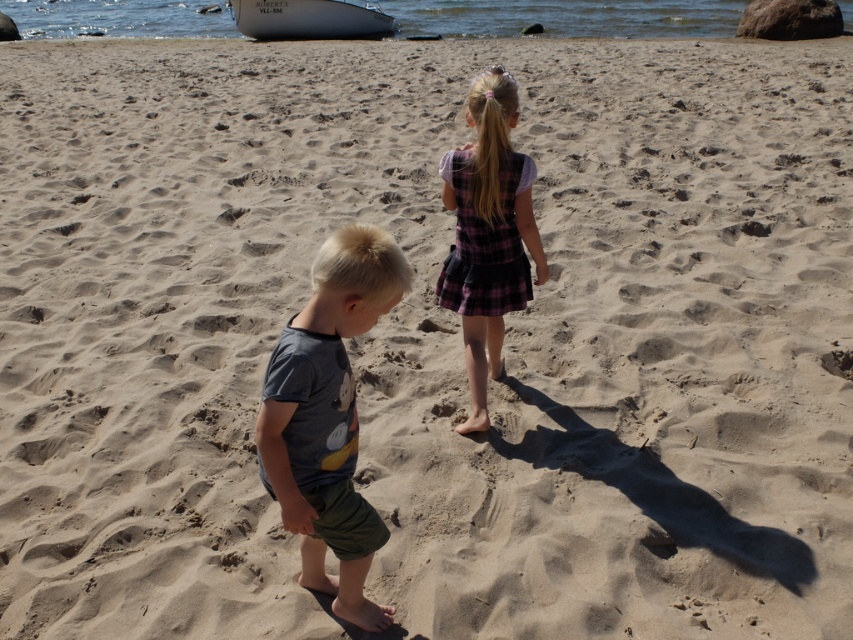
You are standing on the beach and want to pick up the dark gray cotton shirt at center and the white glossy boat at upper center. Which object can you reach without moving your feet?

The dark gray cotton shirt at center is closer to the viewer than the white glossy boat at upper center, so you can reach it without moving your feet.

You are a photographer trying to capture both the dark gray cotton shirt at center and the plaid fabric dress at center in the same frame. Since you want to ensure both are fully visible, which clothing item requires more space in the frame due to its width?

The plaid fabric dress at center requires more space in the frame because its width is greater than the dark gray cotton shirt at center.

You are a photographer trying to capture the children on the sandy beach. You want to ensure that the dark gray cotton shirt at center is visible in the frame. Based on its coordinates, where should you position your camera to include it?

The dark gray cotton shirt at center is located at coordinates point (328, 417), so positioning the camera to focus on that point will ensure it is visible in the frame.